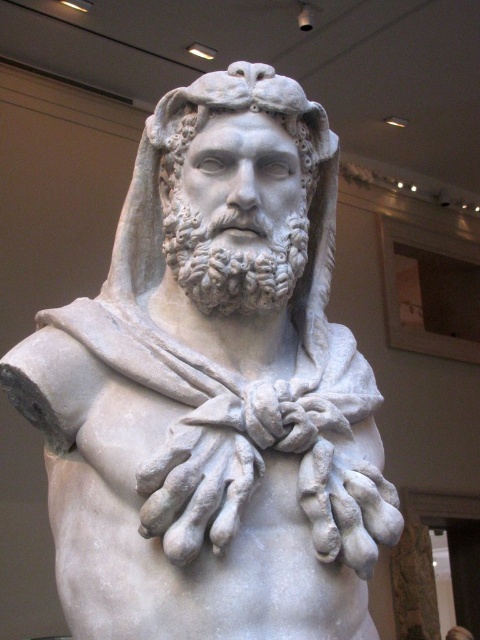
Question: Is white marble head at center to the left of white marble hands at center from the viewer's perspective?

Choices:
 (A) yes
 (B) no

Answer: (B)

Question: Can you confirm if white marble head at center is positioned above white marble hands at center?

Choices:
 (A) no
 (B) yes

Answer: (B)

Question: Can you confirm if white marble head at center is positioned to the right of white marble hands at center?

Choices:
 (A) no
 (B) yes

Answer: (B)

Question: Which point is farther to the camera?

Choices:
 (A) (166, 99)
 (B) (184, 557)

Answer: (A)